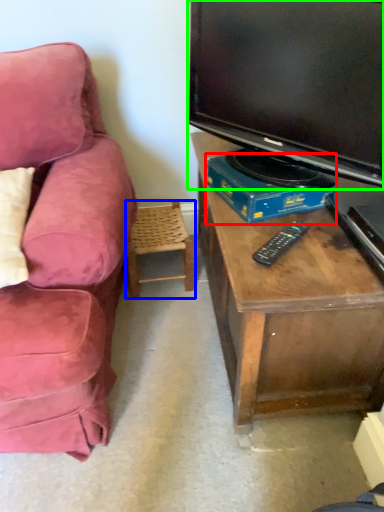
Question: Estimate the real-world distances between objects in this image. Which object is farther from book (highlighted by a red box), chair (highlighted by a blue box) or television (highlighted by a green box)?

Choices:
 (A) chair
 (B) television

Answer: (A)